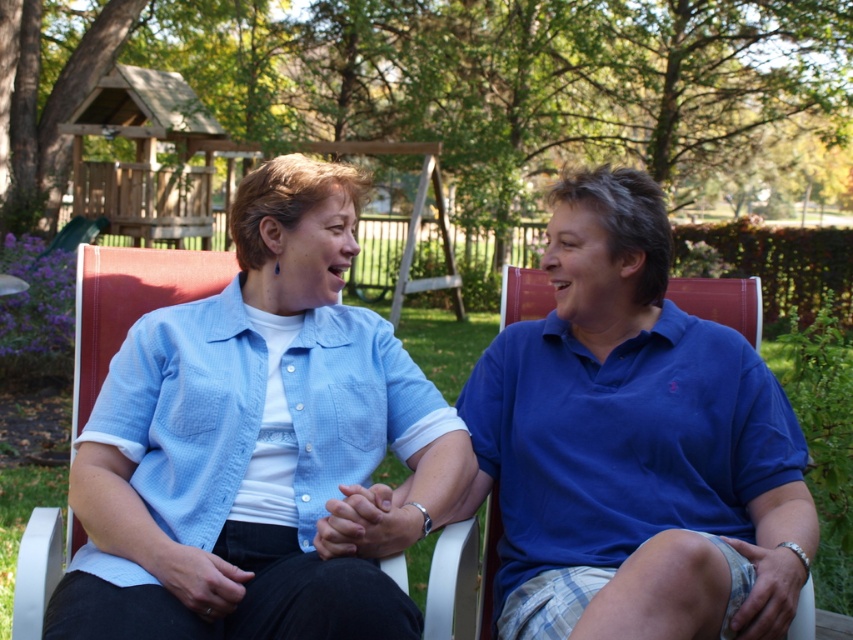
Question: Does light blue fabric shirt at center appear over blue cotton polo shirt at center?

Choices:
 (A) no
 (B) yes

Answer: (B)

Question: Is light blue fabric shirt at center bigger than blue cotton polo shirt at center?

Choices:
 (A) no
 (B) yes

Answer: (A)

Question: Where is light blue fabric shirt at center located in relation to blue cotton polo shirt at center in the image?

Choices:
 (A) above
 (B) below

Answer: (A)

Question: Which point is closer to the camera?

Choices:
 (A) blue cotton polo shirt at center
 (B) light blue fabric shirt at center

Answer: (A)